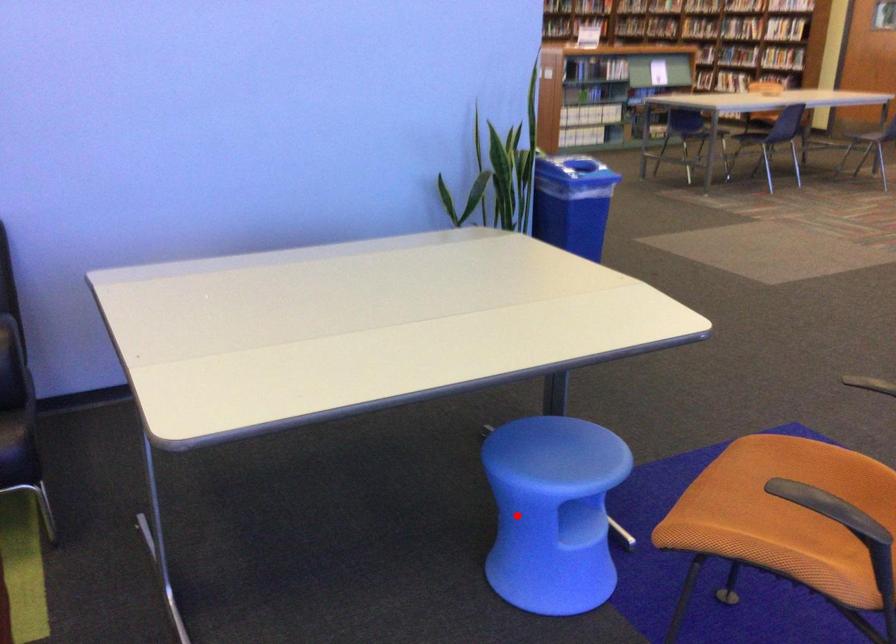
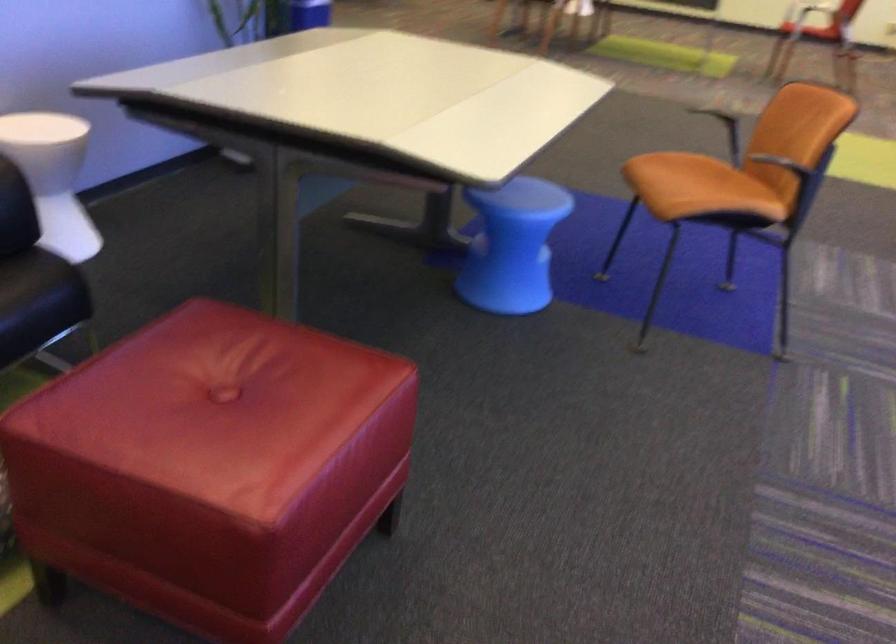
Locate, in the second image, the point that corresponds to the highlighted location in the first image.

(512, 245)